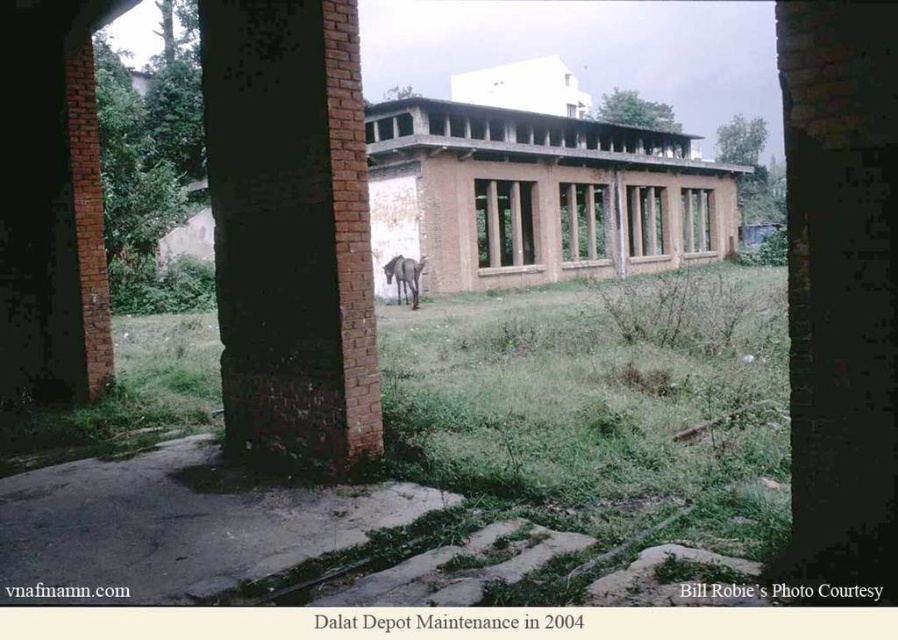
Which is above, green grass at center or gray matte horse at center?

gray matte horse at center is above.

Can you confirm if green grass at center is taller than gray matte horse at center?

Correct, green grass at center is much taller as gray matte horse at center.

Between point (587, 464) and point (412, 273), which one is positioned in front?

Point (587, 464)

Where is `green grass at center`? This screenshot has width=898, height=640. green grass at center is located at coordinates (436, 451).

Does green grass at center appear over brick at center?

Actually, green grass at center is below brick at center.

Who is lower down, green grass at center or brick at center?

green grass at center is lower down.

Image resolution: width=898 pixels, height=640 pixels. What are the coordinates of `green grass at center` in the screenshot? It's located at (436, 451).

Does brick at center have a greater height compared to gray matte horse at center?

Yes.

Who is shorter, brick at center or gray matte horse at center?

With less height is gray matte horse at center.

Between point (247, 413) and point (397, 294), which one is positioned behind?

The point (397, 294) is more distant.

The width and height of the screenshot is (898, 640). Identify the location of brick at center. (289, 230).